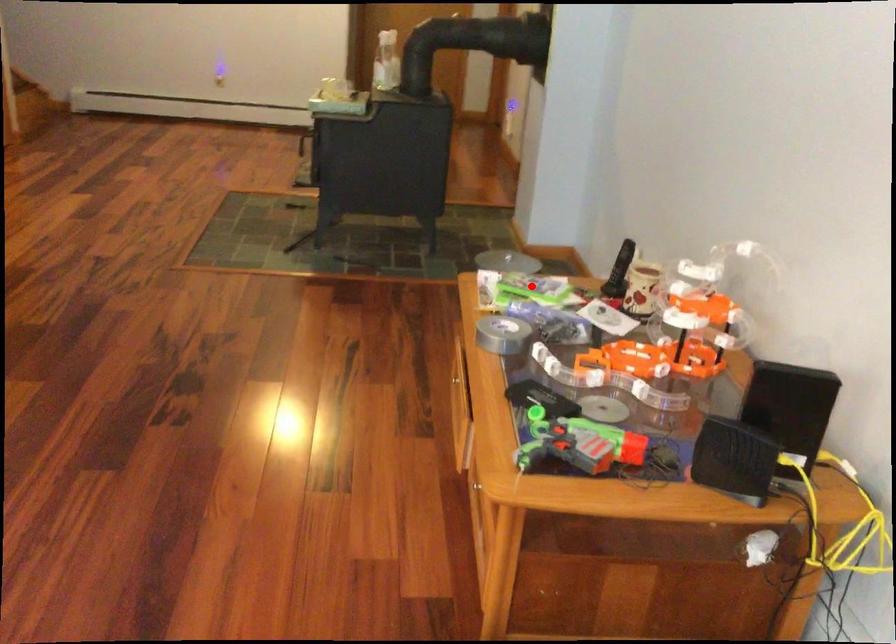
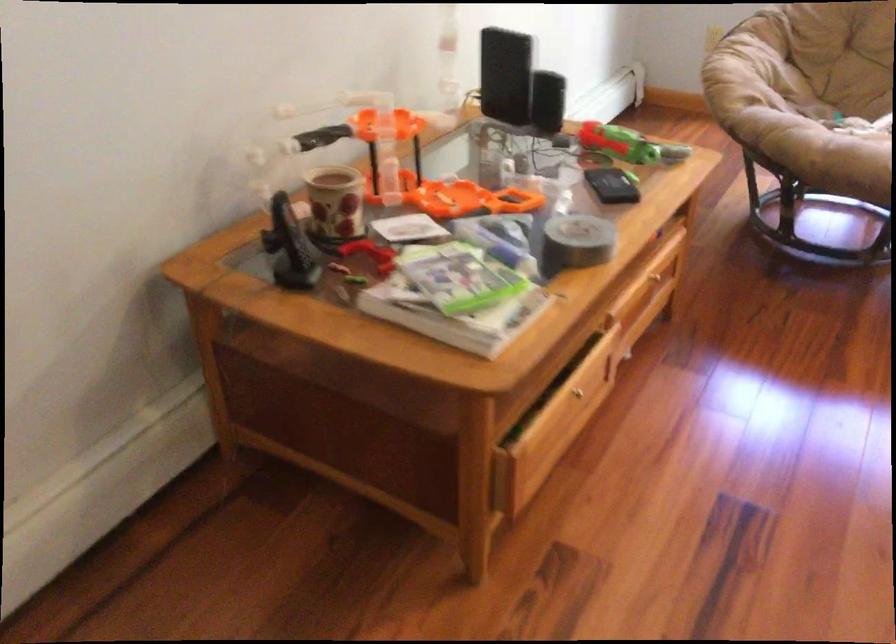
Question: I am providing you with two images of the same scene from different viewpoints. In image1, a red point is highlighted. Considering the same 3D point in image2, which of the following is correct?

Choices:
 (A) It is closer
 (B) It is farther

Answer: (A)